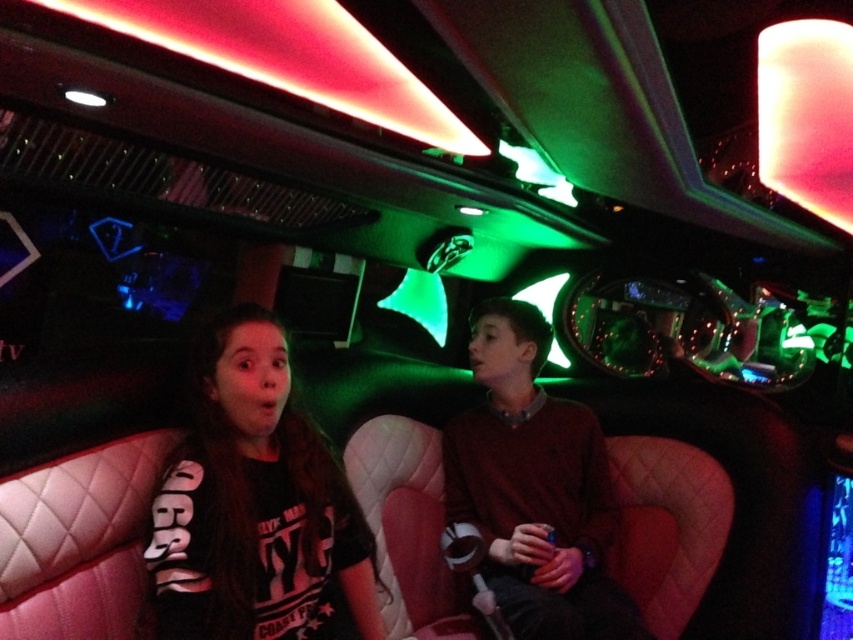
You are a photographer inside the party bus and want to take a photo of both the black cotton shirt at center and the matte brown sweater at center. Since you can only focus on one object at a time, which one should you focus on first if you want to capture them in the correct left to right order?

The black cotton shirt at center is to the left of the matte brown sweater at center, so you should focus on the black cotton shirt at center first to capture them in the correct left to right order.

You are designing a new clothing rack for a boutique and need to arrange the black cotton shirt at center and the matte brown sweater at center. Which item should you place on the narrower hanger?

The black cotton shirt at center has a lesser width compared to the matte brown sweater at center, so it should be placed on the narrower hanger.

You are standing in front of the party bus interior and notice a specific point marked at coordinates point (354, 602). If you want to reach this point with your hand, which is about 2.5 feet long, can you comfortably reach it without moving your body?

The point (354, 602) is 6.03 feet from the viewer. Since your hand is only about 2.5 feet long, you cannot comfortably reach it without moving your body.